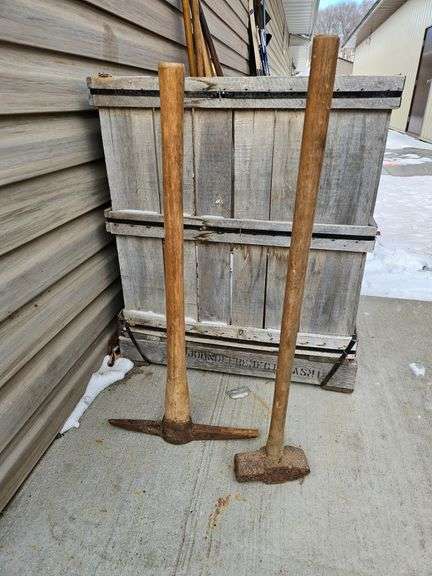
Where is `wall 2`? The image size is (432, 576). wall 2 is located at coordinates (407, 55).